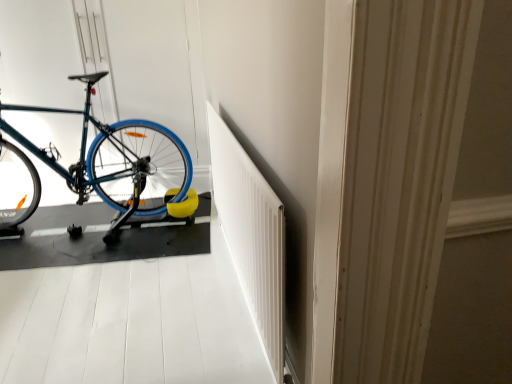
Question: Is teal matte bicycle at left bigger than blue rubber bike at left?

Choices:
 (A) no
 (B) yes

Answer: (B)

Question: Would you say teal matte bicycle at left is a long distance from blue rubber bike at left?

Choices:
 (A) yes
 (B) no

Answer: (B)

Question: Is teal matte bicycle at left at the left side of blue rubber bike at left?

Choices:
 (A) yes
 (B) no

Answer: (A)

Question: Considering the relative sizes of teal matte bicycle at left and blue rubber bike at left in the image provided, is teal matte bicycle at left wider than blue rubber bike at left?

Choices:
 (A) yes
 (B) no

Answer: (B)

Question: Considering the relative sizes of teal matte bicycle at left and blue rubber bike at left in the image provided, is teal matte bicycle at left shorter than blue rubber bike at left?

Choices:
 (A) no
 (B) yes

Answer: (A)

Question: Is teal matte bicycle at left beside blue rubber bike at left?

Choices:
 (A) yes
 (B) no

Answer: (B)

Question: From a real-world perspective, is teal matte bicycle at left under white textured radiator at center?

Choices:
 (A) yes
 (B) no

Answer: (B)

Question: Is teal matte bicycle at left with white textured radiator at center?

Choices:
 (A) yes
 (B) no

Answer: (B)

Question: Is teal matte bicycle at left outside of white textured radiator at center?

Choices:
 (A) yes
 (B) no

Answer: (A)

Question: Is teal matte bicycle at left oriented towards white textured radiator at center?

Choices:
 (A) no
 (B) yes

Answer: (A)

Question: Is teal matte bicycle at left looking in the opposite direction of white textured radiator at center?

Choices:
 (A) no
 (B) yes

Answer: (A)

Question: From the image's perspective, does teal matte bicycle at left appear higher than white textured radiator at center?

Choices:
 (A) no
 (B) yes

Answer: (B)

Question: From a real-world perspective, is blue rubber bike at left on teal matte bicycle at left?

Choices:
 (A) yes
 (B) no

Answer: (B)